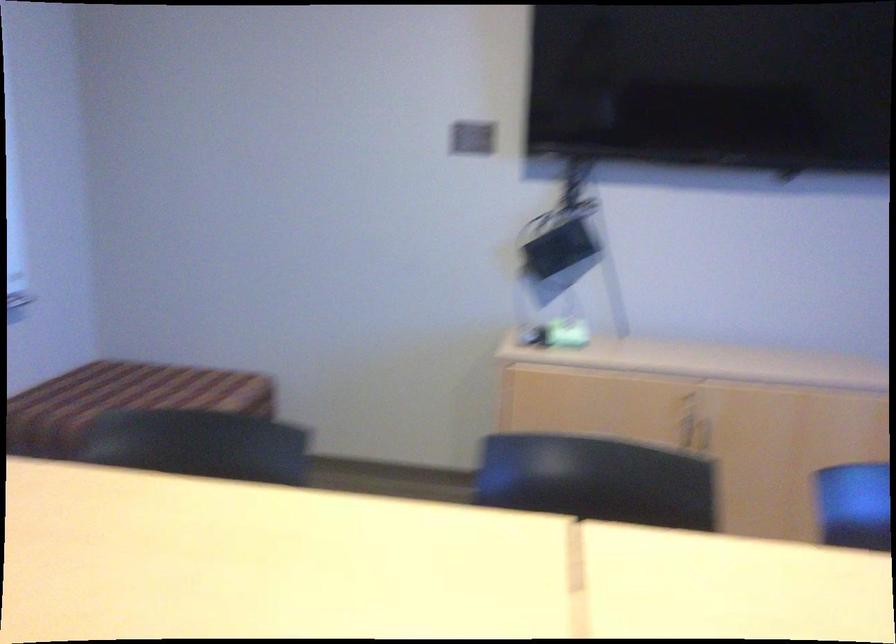
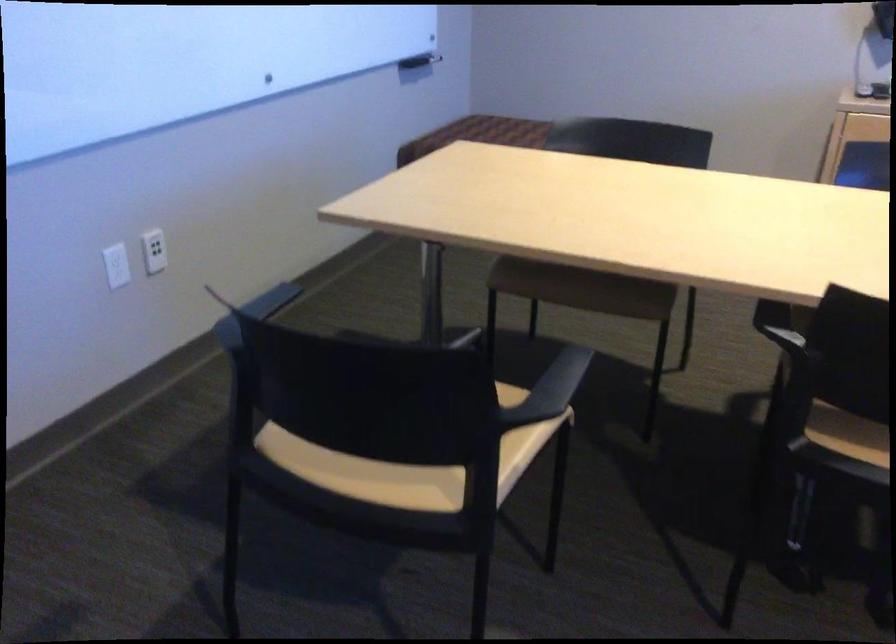
Question: The camera is either moving clockwise (left) or counter-clockwise (right) around the object. The first image is from the beginning of the video and the second image is from the end. Is the camera moving left or right when shooting the video?

Choices:
 (A) Left
 (B) Right

Answer: (B)